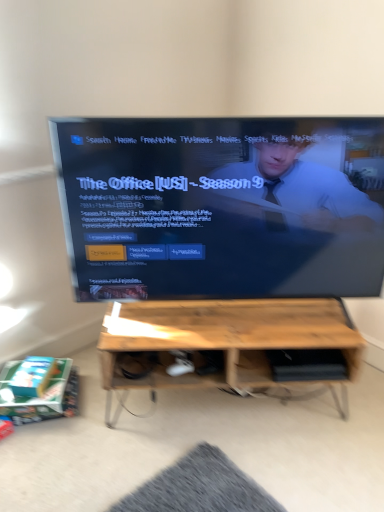
Where is `free spot above wooden table at center (from a real-world perspective)`? free spot above wooden table at center (from a real-world perspective) is located at coordinates (232, 317).